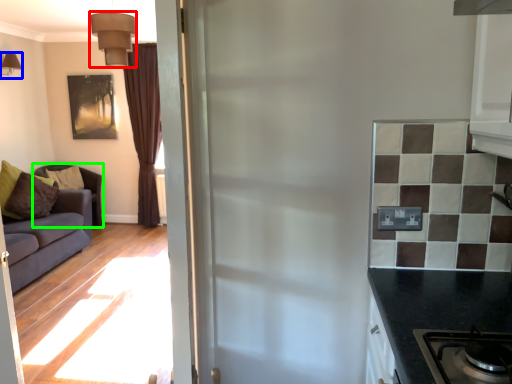
Question: Based on their relative distances, which object is farther from lamp (highlighted by a red box)? Choose from lamp (highlighted by a blue box) and studio couch (highlighted by a green box).

Choices:
 (A) lamp
 (B) studio couch

Answer: (B)